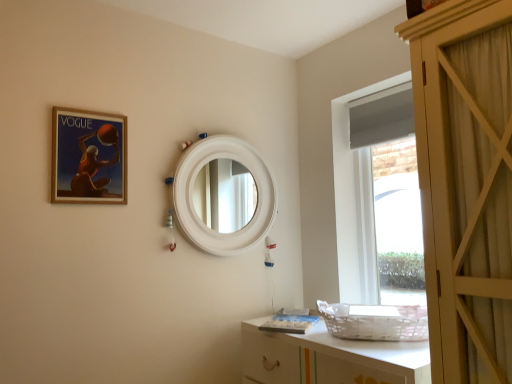
Question: Is matte wooden picture frame at upper left in front of or behind white matte mirror at center in the image?

Choices:
 (A) front
 (B) behind

Answer: (A)

Question: Considering the positions of matte wooden picture frame at upper left and white matte mirror at center in the image, is matte wooden picture frame at upper left taller or shorter than white matte mirror at center?

Choices:
 (A) short
 (B) tall

Answer: (A)

Question: Which of these objects is positioned closest to the matte wooden picture frame at upper left?

Choices:
 (A) white matte mirror at center
 (B) white glossy cabinet at lower right

Answer: (A)

Question: Estimate the real-world distances between objects in this image. Which object is closer to the white glossy cabinet at lower right?

Choices:
 (A) white matte mirror at center
 (B) matte wooden picture frame at upper left

Answer: (A)